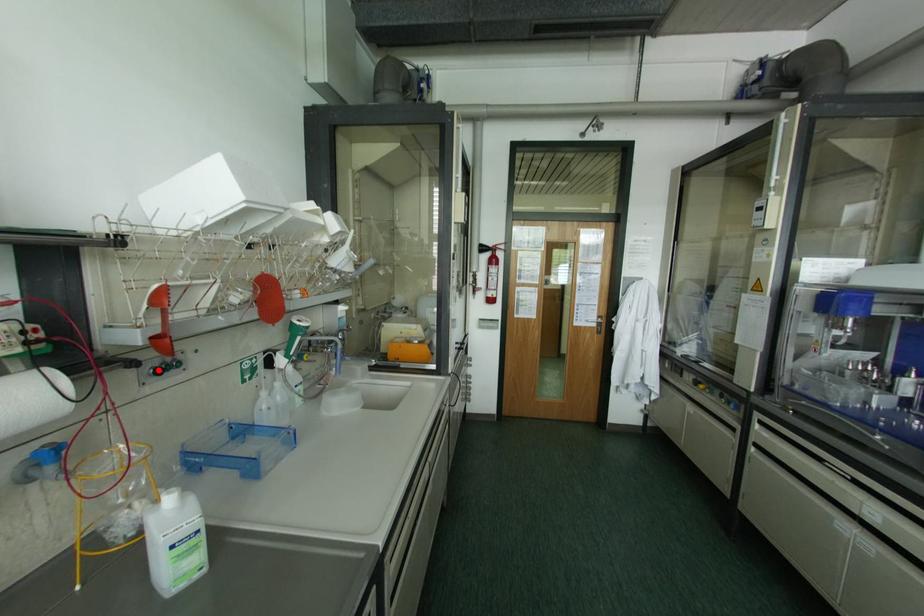
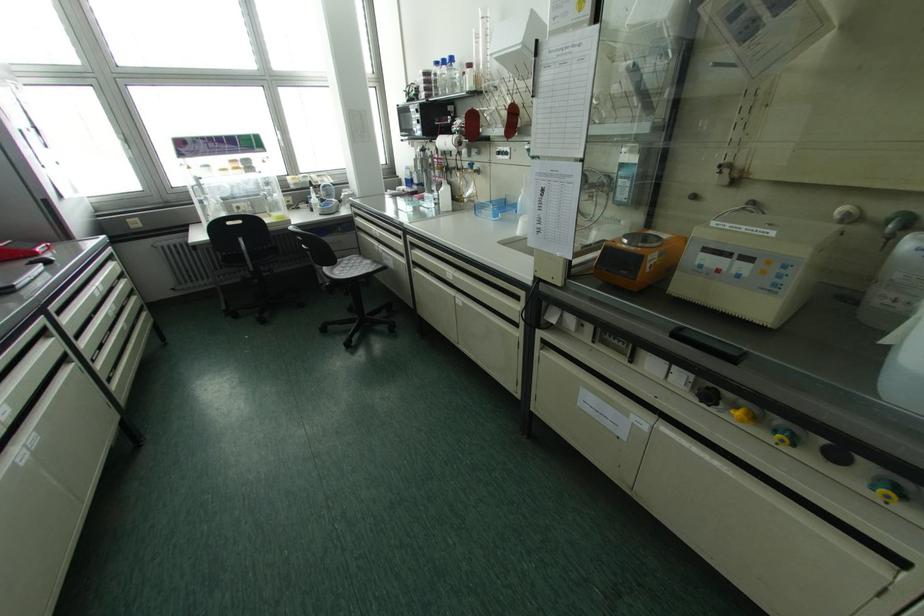
Question: A red point is marked in image1. In image2, is the corresponding 3D point closer to the camera or farther? Reply with the corresponding letter.

Choices:
 (A) The corresponding 3D point is closer.
 (B) The corresponding 3D point is farther.

Answer: (A)